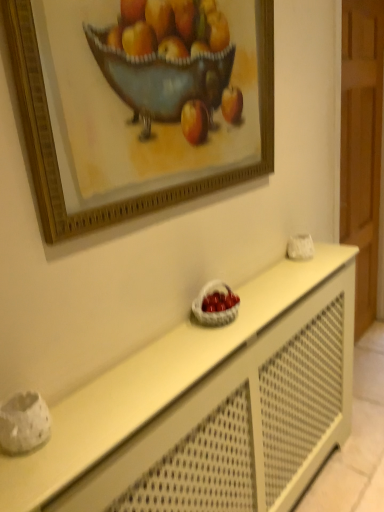
The image size is (384, 512). What do you see at coordinates (140, 196) in the screenshot?
I see `gold wooden picture frame at upper center` at bounding box center [140, 196].

This screenshot has width=384, height=512. What do you see at coordinates (216, 311) in the screenshot?
I see `white woven basket at center` at bounding box center [216, 311].

Where is `white matte table at center`? Image resolution: width=384 pixels, height=512 pixels. white matte table at center is located at coordinates (209, 407).

Describe the element at coordinates (209, 407) in the screenshot. The image size is (384, 512). I see `white matte table at center` at that location.

Locate an element on the screen. The image size is (384, 512). gold wooden picture frame at upper center is located at coordinates 140,196.

Considering their positions, is white matte table at center located in front of or behind gold wooden picture frame at upper center?

Visually, white matte table at center is located behind gold wooden picture frame at upper center.

Is white matte table at center inside or outside of gold wooden picture frame at upper center?

white matte table at center is located beyond the bounds of gold wooden picture frame at upper center.

From a real-world perspective, who is located higher, white matte table at center or gold wooden picture frame at upper center?

gold wooden picture frame at upper center.

Could you tell me if white matte table at center is turned towards gold wooden picture frame at upper center?

No, white matte table at center is not turned towards gold wooden picture frame at upper center.

From a real-world perspective, is gold wooden picture frame at upper center below white woven basket at center?

No.

From the image's perspective, who appears lower, gold wooden picture frame at upper center or white woven basket at center?

white woven basket at center appears lower in the image.

Consider the image. Is the surface of gold wooden picture frame at upper center in direct contact with white woven basket at center?

gold wooden picture frame at upper center is not next to white woven basket at center, and they're not touching.

In the scene shown: Can you confirm if gold wooden picture frame at upper center is bigger than white woven basket at center?

Yes, gold wooden picture frame at upper center is bigger than white woven basket at center.

Is there a large distance between white matte table at center and white woven basket at center?

No, white matte table at center is not far from white woven basket at center.

Is white matte table at center turned away from white woven basket at center?

That's not correct — white matte table at center is not looking away from white woven basket at center.

From the image's perspective, which is below, white matte table at center or white woven basket at center?

white matte table at center.

Is white woven basket at center further to camera compared to white matte table at center?

Yes, white woven basket at center is further from the camera.

Is white woven basket at center positioned with its back to white matte table at center?

white woven basket at center does not have its back to white matte table at center.

Is white woven basket at center not near white matte table at center?

No.

Does white woven basket at center touch gold wooden picture frame at upper center?

No, white woven basket at center is not beside gold wooden picture frame at upper center.

Is white woven basket at center at the right side of gold wooden picture frame at upper center?

Yes.

Based on their sizes in the image, would you say white woven basket at center is bigger or smaller than gold wooden picture frame at upper center?

white woven basket at center is smaller than gold wooden picture frame at upper center.

Is gold wooden picture frame at upper center positioned behind white matte table at center?

No, it is not.

From the image's perspective, which one is positioned higher, gold wooden picture frame at upper center or white matte table at center?

From the image's view, gold wooden picture frame at upper center is above.

Are gold wooden picture frame at upper center and white matte table at center making contact?

No, gold wooden picture frame at upper center is not touching white matte table at center.

Considering the points (30, 126) and (347, 264), which point is in front, point (30, 126) or point (347, 264)?

The point (30, 126) is more forward.

Find the location of a particular element. picture frame in front of the white matte table at center is located at coordinates (140, 196).

In the image, there is a gold wooden picture frame at upper center. Where is `basket below it (from the image's perspective)`? This screenshot has width=384, height=512. basket below it (from the image's perspective) is located at coordinates (216, 311).

From the image, which object appears to be farther from white matte table at center, white woven basket at center or gold wooden picture frame at upper center?

gold wooden picture frame at upper center.

Which object lies nearer to the anchor point gold wooden picture frame at upper center, white matte table at center or white woven basket at center?

white woven basket at center lies closer to gold wooden picture frame at upper center than the other object.

Based on their spatial positions, is white woven basket at center or white matte table at center further from gold wooden picture frame at upper center?

Among the two, white matte table at center is located further to gold wooden picture frame at upper center.

In the scene shown: Based on their spatial positions, is white matte table at center or gold wooden picture frame at upper center closer to white woven basket at center?

The object closer to white woven basket at center is white matte table at center.

From the picture: When comparing their distances from white matte table at center, does gold wooden picture frame at upper center or white woven basket at center seem further?

Based on the image, gold wooden picture frame at upper center appears to be further to white matte table at center.

Looking at the image, which one is located closer to white woven basket at center, gold wooden picture frame at upper center or white matte table at center?

Based on the image, white matte table at center appears to be nearer to white woven basket at center.

At what (x,y) coordinates should I click in order to perform the action: click on basket between gold wooden picture frame at upper center and white matte table at center vertically. Please return your answer as a coordinate pair (x, y). The height and width of the screenshot is (512, 384). Looking at the image, I should click on (216, 311).